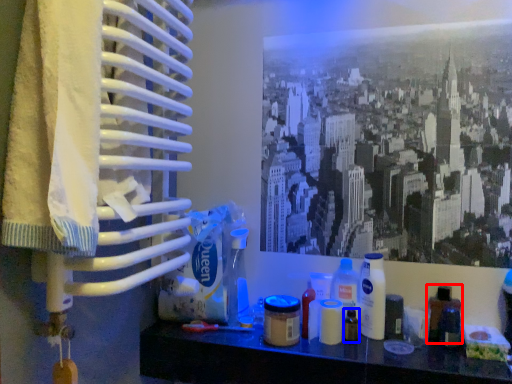
Question: Which object is further to the camera taking this photo, bottle (highlighted by a red box) or toiletry (highlighted by a blue box)?

Choices:
 (A) bottle
 (B) toiletry

Answer: (B)